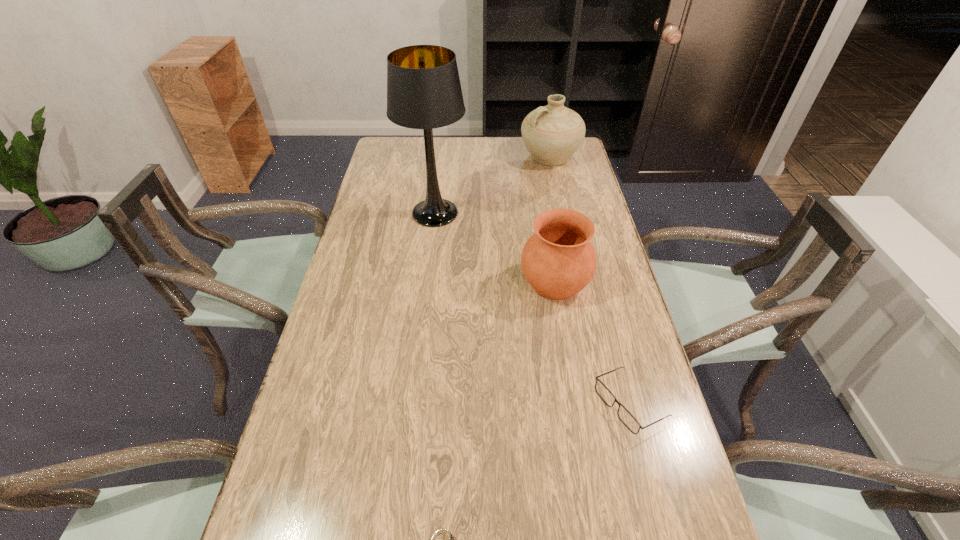
Locate an element on the screen. The image size is (960, 540). blank space located 0.400m with the lenses facing outward on the second shortest object is located at coordinates (420, 404).

Identify the location of vacant space situated with the lenses facing outward on the second shortest object. The height and width of the screenshot is (540, 960). (487, 404).

Where is `free space located 0.080m with the lenses facing outward on the second shortest object`? Image resolution: width=960 pixels, height=540 pixels. free space located 0.080m with the lenses facing outward on the second shortest object is located at coordinates (562, 404).

Find the location of a particular element. The image size is (960, 540). object at the far edge is located at coordinates (552, 134).

Find the location of `object located at the left edge`. object located at the left edge is located at coordinates (424, 92).

I want to click on spectacles that is at the right edge, so click(625, 416).

Where is `object at the far right corner`? The width and height of the screenshot is (960, 540). object at the far right corner is located at coordinates (552, 134).

The image size is (960, 540). In order to click on blank space at the far edge of the desktop in this screenshot , I will do pos(436,145).

You are a GUI agent. You are given a task and a screenshot of the screen. Output one action in this format:
    pyautogui.click(x=<x>, y=<y>)
    Task: Click on the free space at the left edge of the desktop
    
    Given the screenshot: What is the action you would take?
    pyautogui.click(x=386, y=291)

Find the location of a particular element. vacant space at the right edge of the desktop is located at coordinates (612, 459).